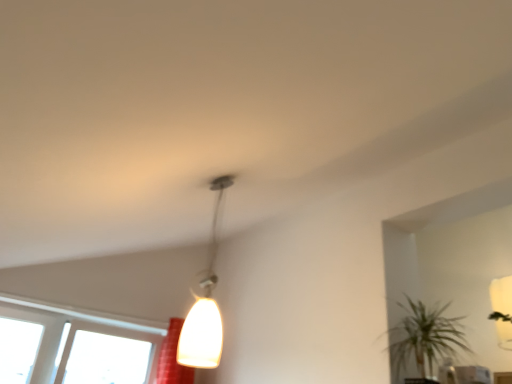
Find the location of `green leafy plant at lower right`. green leafy plant at lower right is located at coordinates (424, 339).

I want to click on transparent glass window at lower left, so click(71, 349).

In order to face white glossy pendant light at center, should I rotate leftwards or rightwards?

A 6.923 degree turn to the left will do.

What do you see at coordinates (205, 305) in the screenshot? I see `white glossy pendant light at center` at bounding box center [205, 305].

Identify the location of green leafy plant at lower right. Image resolution: width=512 pixels, height=384 pixels. click(x=424, y=339).

Is transparent glass window at lower left not close to green leafy plant at lower right?

Yes, transparent glass window at lower left is far from green leafy plant at lower right.

Consider the image. Is transparent glass window at lower left inside or outside of green leafy plant at lower right?

The correct answer is: outside.

Is transparent glass window at lower left facing away from green leafy plant at lower right?

No, transparent glass window at lower left is not facing the opposite direction of green leafy plant at lower right.

In the scene shown: Considering the positions of objects transparent glass window at lower left and green leafy plant at lower right in the image provided, who is more to the right, transparent glass window at lower left or green leafy plant at lower right?

Positioned to the right is green leafy plant at lower right.

Considering the positions of point (116, 336) and point (207, 298), is point (116, 336) closer or farther from the camera than point (207, 298)?

Clearly, point (116, 336) is more distant from the camera than point (207, 298).

Is transparent glass window at lower left next to white glossy pendant light at center?

There is a gap between transparent glass window at lower left and white glossy pendant light at center.

Is transparent glass window at lower left shorter than white glossy pendant light at center?

Yes, transparent glass window at lower left is shorter than white glossy pendant light at center.

Between green leafy plant at lower right and white glossy pendant light at center, which one has larger width?

With larger width is green leafy plant at lower right.

Which is behind, point (404, 362) or point (195, 364)?

Point (404, 362)

Where is `lamp located in front of the green leafy plant at lower right`? lamp located in front of the green leafy plant at lower right is located at coordinates (205, 305).

Between green leafy plant at lower right and white glossy pendant light at center, which one has less height?

green leafy plant at lower right is shorter.

Measure the distance between white glossy pendant light at center and transparent glass window at lower left.

white glossy pendant light at center is 7.37 feet from transparent glass window at lower left.

Considering the relative sizes of white glossy pendant light at center and transparent glass window at lower left in the image provided, is white glossy pendant light at center taller than transparent glass window at lower left?

Yes.

Where is `lamp above the transparent glass window at lower left (from the image's perspective)`? This screenshot has width=512, height=384. lamp above the transparent glass window at lower left (from the image's perspective) is located at coordinates (205, 305).

Is white glossy pendant light at center situated inside transparent glass window at lower left or outside?

white glossy pendant light at center cannot be found inside transparent glass window at lower left.

Considering the positions of objects white glossy pendant light at center and green leafy plant at lower right in the image provided, who is in front, white glossy pendant light at center or green leafy plant at lower right?

white glossy pendant light at center is more forward.

What's the angular difference between white glossy pendant light at center and green leafy plant at lower right's facing directions?

The facing directions of white glossy pendant light at center and green leafy plant at lower right are 94.8 degrees apart.

Consider the image. From the image's perspective, which is below, white glossy pendant light at center or green leafy plant at lower right?

green leafy plant at lower right is shown below in the image.

Between point (213, 304) and point (446, 343), which one is positioned behind?

The point (446, 343) is farther.

Considering the points (425, 316) and (24, 338), which point is behind, point (425, 316) or point (24, 338)?

The point (24, 338) is behind.

From the image's perspective, does green leafy plant at lower right appear lower than transparent glass window at lower left?

No, from the image's perspective, green leafy plant at lower right is not beneath transparent glass window at lower left.

Is the surface of green leafy plant at lower right in direct contact with transparent glass window at lower left?

No, green leafy plant at lower right is not touching transparent glass window at lower left.

Image resolution: width=512 pixels, height=384 pixels. What are the coordinates of `window below the green leafy plant at lower right (from the image's perspective)` in the screenshot? It's located at (71, 349).

The height and width of the screenshot is (384, 512). What are the coordinates of `window on the left side of white glossy pendant light at center` in the screenshot? It's located at (71, 349).

From the image, which object appears to be nearer to white glossy pendant light at center, green leafy plant at lower right or transparent glass window at lower left?

green leafy plant at lower right.

Which object lies further to the anchor point green leafy plant at lower right, transparent glass window at lower left or white glossy pendant light at center?

transparent glass window at lower left.

In the scene shown: Estimate the real-world distances between objects in this image. Which object is closer to transparent glass window at lower left, green leafy plant at lower right or white glossy pendant light at center?

The object closer to transparent glass window at lower left is white glossy pendant light at center.

Based on the photo, considering their positions, is transparent glass window at lower left positioned closer to white glossy pendant light at center than green leafy plant at lower right?

green leafy plant at lower right lies closer to white glossy pendant light at center than the other object.

Based on their spatial positions, is white glossy pendant light at center or green leafy plant at lower right further from transparent glass window at lower left?

Among the two, green leafy plant at lower right is located further to transparent glass window at lower left.

Looking at the image, which one is located closer to green leafy plant at lower right, white glossy pendant light at center or transparent glass window at lower left?

white glossy pendant light at center lies closer to green leafy plant at lower right than the other object.

This screenshot has width=512, height=384. What are the coordinates of `lamp between transparent glass window at lower left and green leafy plant at lower right in the horizontal direction` in the screenshot? It's located at (205, 305).